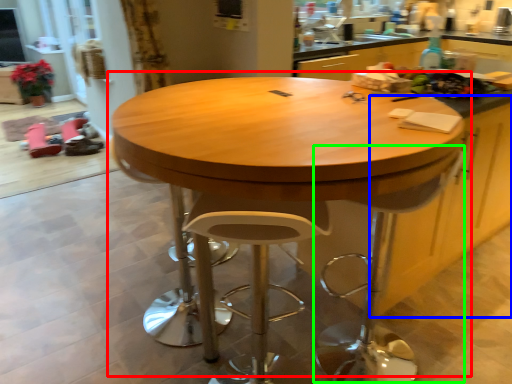
Question: Which object is positioned farthest from table (highlighted by a red box)? Select from cabinetry (highlighted by a blue box) and swivel chair (highlighted by a green box).

Choices:
 (A) cabinetry
 (B) swivel chair

Answer: (A)